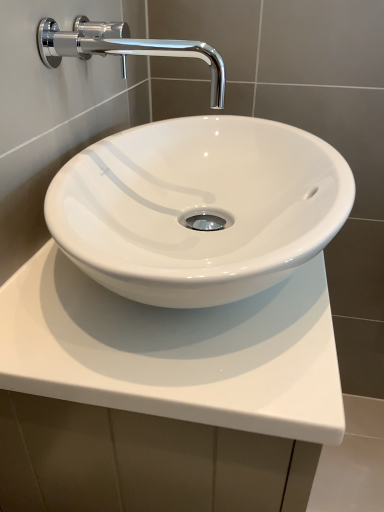
Question: Looking at their shapes, would you say chrome/metallic faucet at upper left is wider or thinner than white glossy countertop at center?

Choices:
 (A) thin
 (B) wide

Answer: (A)

Question: In terms of size, does chrome/metallic faucet at upper left appear bigger or smaller than white glossy countertop at center?

Choices:
 (A) small
 (B) big

Answer: (A)

Question: From the image's perspective, is chrome/metallic faucet at upper left above or below white glossy countertop at center?

Choices:
 (A) above
 (B) below

Answer: (A)

Question: From a real-world perspective, is white glossy countertop at center physically located above or below chrome/metallic faucet at upper left?

Choices:
 (A) below
 (B) above

Answer: (A)

Question: Is white glossy countertop at center in front of or behind chrome/metallic faucet at upper left in the image?

Choices:
 (A) behind
 (B) front

Answer: (B)

Question: Would you say white glossy countertop at center is inside or outside chrome/metallic faucet at upper left?

Choices:
 (A) inside
 (B) outside

Answer: (B)

Question: Does point (182, 386) appear closer or farther from the camera than point (122, 42)?

Choices:
 (A) closer
 (B) farther

Answer: (A)